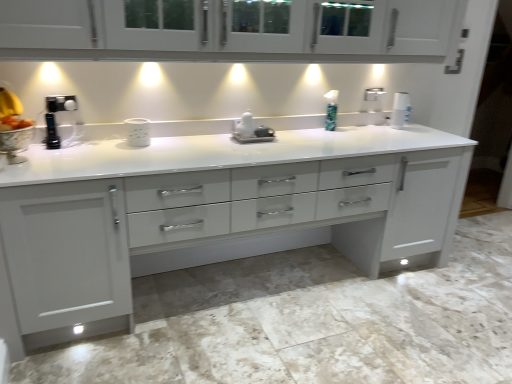
Identify the location of vacant space underneath white glossy countertop at center (from a real-world perspective). This screenshot has width=512, height=384. (241, 283).